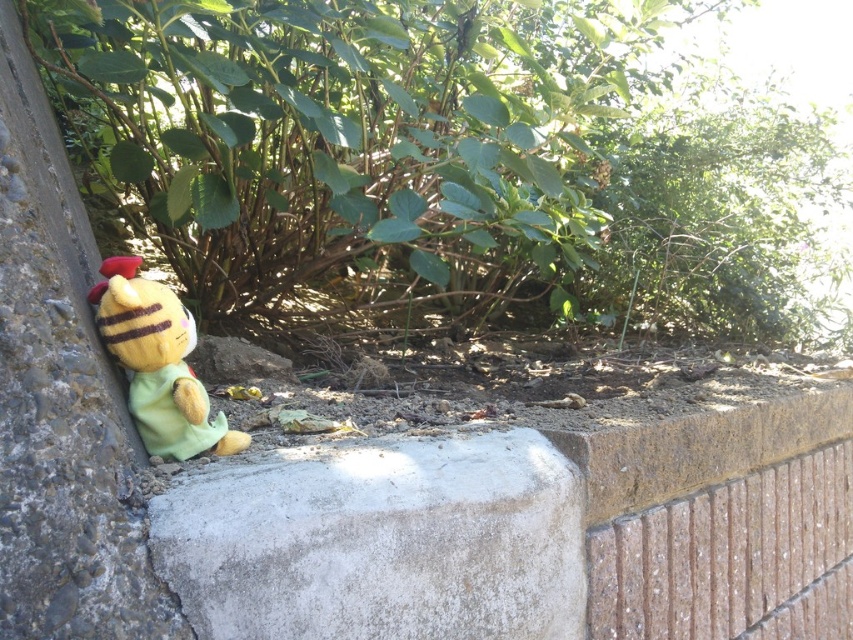
You are a small robot trying to place a flower pot on the gray concrete block at center. The yellow plush toy at left is in your way. Can you move the flower pot around the toy to reach the block?

The gray concrete block at center is located below the yellow plush toy at left, so you can move the flower pot around the toy by going underneath it to reach the block.

You are standing in the scene and want to place a small potted plant exactly at the point marked by the coordinates point [357,138]. What object will the potted plant be placed near?

The point [357,138] marks green leafy bush at center, so the potted plant will be placed near the green leafy bush at center.

Where is the green leafy bush at center located in the image?

The green leafy bush at center is located at point coordinates of 0.216 in the x axis and 0.420 in the y axis.